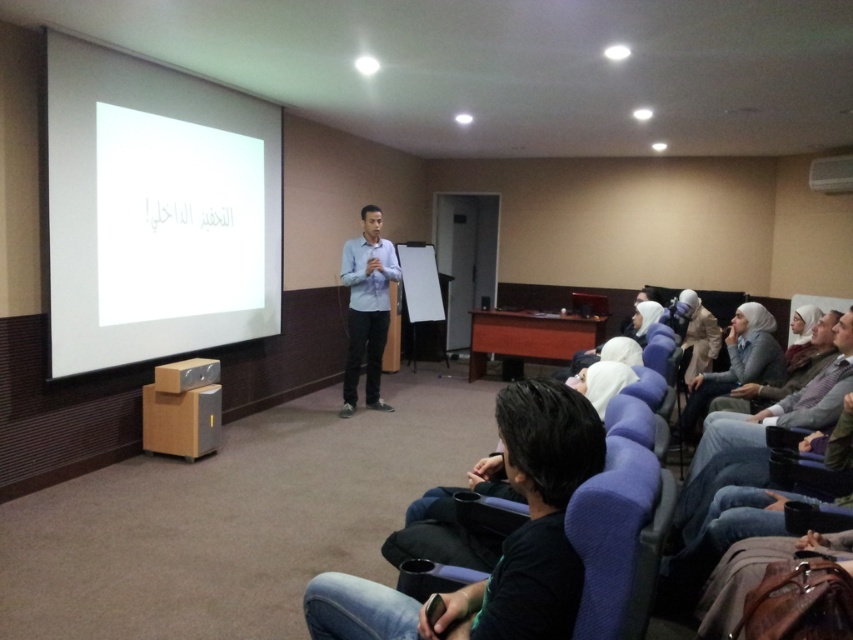
Who is higher up, black matte shirt at lower center or white fabric hijab at lower right?

white fabric hijab at lower right

Can you confirm if black matte shirt at lower center is thinner than white fabric hijab at lower right?

Yes.

Identify the location of black matte shirt at lower center. This screenshot has width=853, height=640. (502, 545).

Is black matte shirt at lower center thinner than light blue shirt at center?

In fact, black matte shirt at lower center might be wider than light blue shirt at center.

Does black matte shirt at lower center appear over light blue shirt at center?

No, black matte shirt at lower center is not above light blue shirt at center.

Between point (360, 586) and point (367, 250), which one is positioned in front?

Positioned in front is point (360, 586).

The width and height of the screenshot is (853, 640). I want to click on black matte shirt at lower center, so pos(502,545).

Between white matte projection screen at upper left and white fabric hijab at lower right, which one has less height?

With less height is white fabric hijab at lower right.

What do you see at coordinates (155, 211) in the screenshot? I see `white matte projection screen at upper left` at bounding box center [155, 211].

Does point (149, 166) come in front of point (775, 369)?

No, (149, 166) is further to viewer.

I want to click on white matte projection screen at upper left, so click(155, 211).